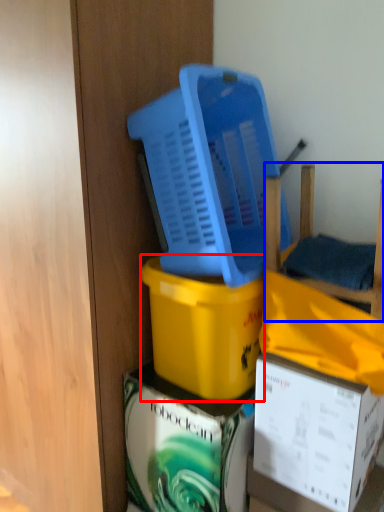
Question: Which object is further to the camera taking this photo, box (highlighted by a red box) or furniture (highlighted by a blue box)?

Choices:
 (A) box
 (B) furniture

Answer: (A)